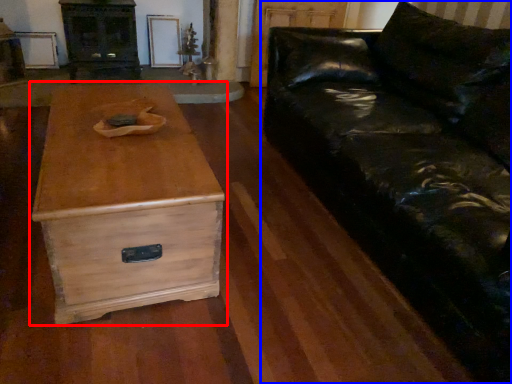
Question: Which of the following is the closest to the observer, chest of drawers (highlighted by a red box) or studio couch (highlighted by a blue box)?

Choices:
 (A) chest of drawers
 (B) studio couch

Answer: (B)